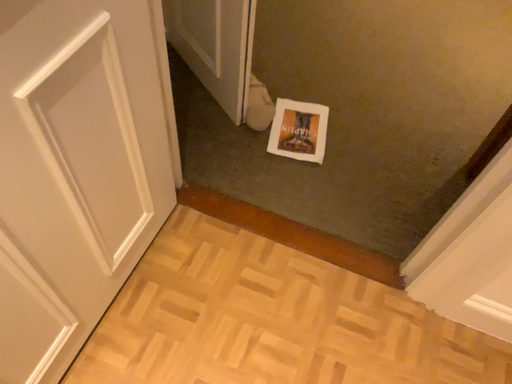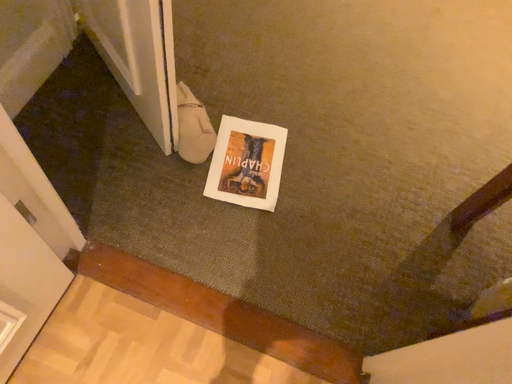
Question: How did the camera likely rotate when shooting the video?

Choices:
 (A) rotated upward
 (B) rotated downward

Answer: (B)